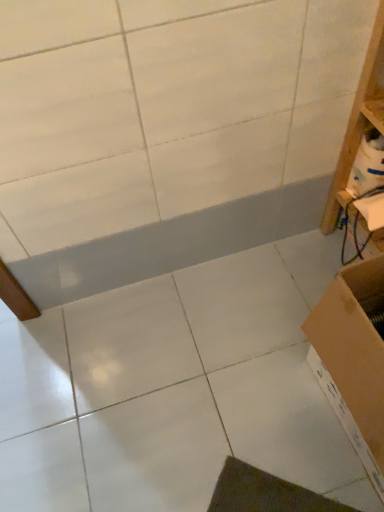
Where is `vacant region to the left of brown cardboard box at lower right`? The image size is (384, 512). vacant region to the left of brown cardboard box at lower right is located at coordinates (253, 420).